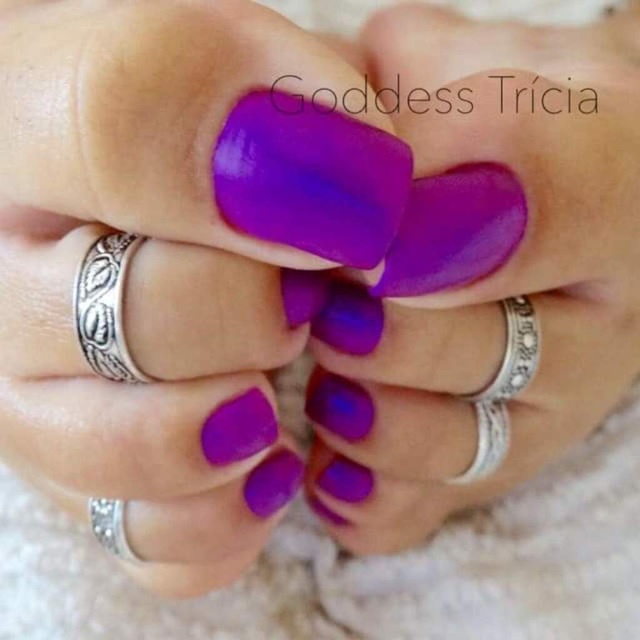
You are a photographer trying to capture a close detail shot of the silver rings on the ring fingers. You are currently positioned at a distance of 12 inches from the point marked at point (129, 305). Can you move closer to get a better shot without exceeding the recommended 14.38 inches safety distance?

The distance between the camera and point (129, 305) is 14.38 inches. Since you are currently at 12 inches, which is within the recommended safety distance, you can move closer to capture the shot without exceeding the limit.